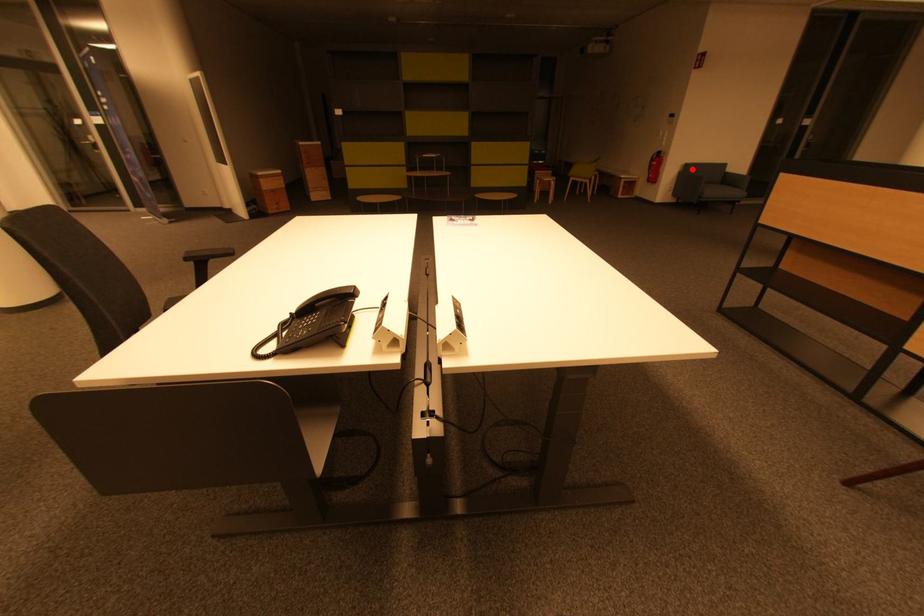
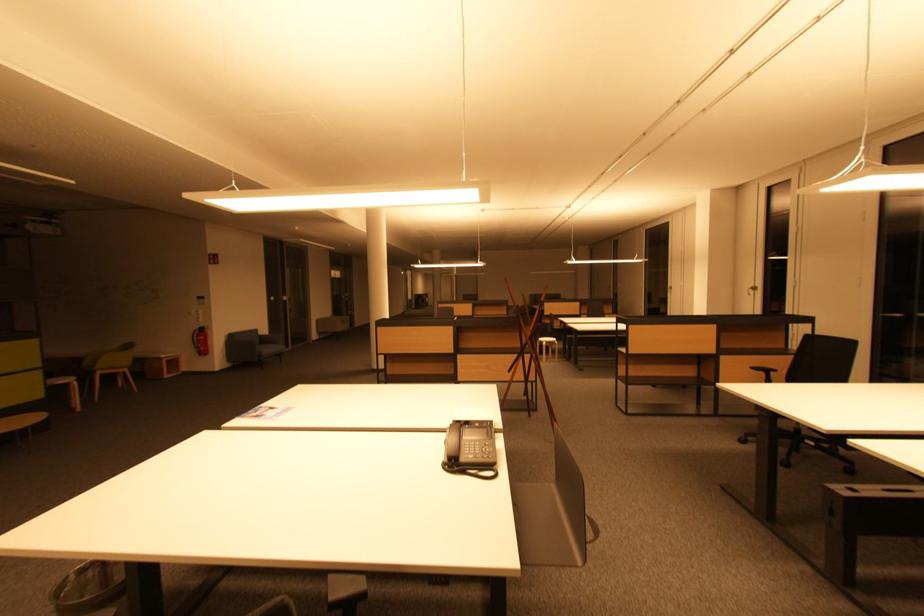
Locate, in the second image, the point that corresponds to the highlighted location in the first image.

(236, 339)